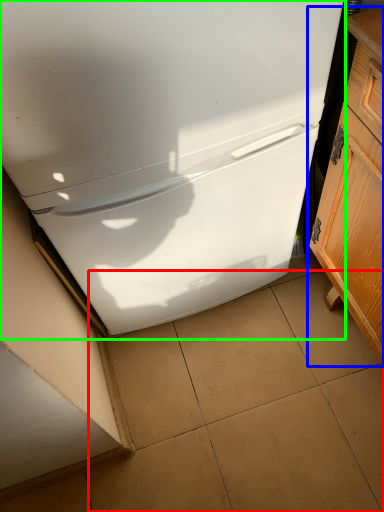
Question: Estimate the real-world distances between objects in this image. Which object is farther from tile (highlighted by a red box), cabinetry (highlighted by a blue box) or refrigerator (highlighted by a green box)?

Choices:
 (A) cabinetry
 (B) refrigerator

Answer: (B)